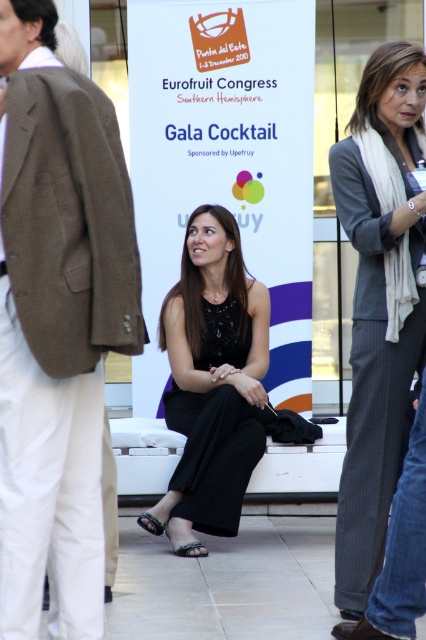
Question: Which object appears closest to the camera in this image?

Choices:
 (A) gray pinstripe blazer at right
 (B) brown checkered blazer at left
 (C) black satin dress at center

Answer: (B)

Question: Is brown checkered blazer at left below black satin dress at center?

Choices:
 (A) yes
 (B) no

Answer: (B)

Question: Which of the following is the farthest from the observer?

Choices:
 (A) (2, 360)
 (B) (146, 515)
 (C) (423, 305)

Answer: (B)

Question: Is black satin dress at center further to camera compared to gray pinstripe blazer at right?

Choices:
 (A) no
 (B) yes

Answer: (B)

Question: Which of these objects is positioned farthest from the black satin dress at center?

Choices:
 (A) brown checkered blazer at left
 (B) gray pinstripe blazer at right

Answer: (A)

Question: Is brown checkered blazer at left below gray pinstripe blazer at right?

Choices:
 (A) no
 (B) yes

Answer: (A)